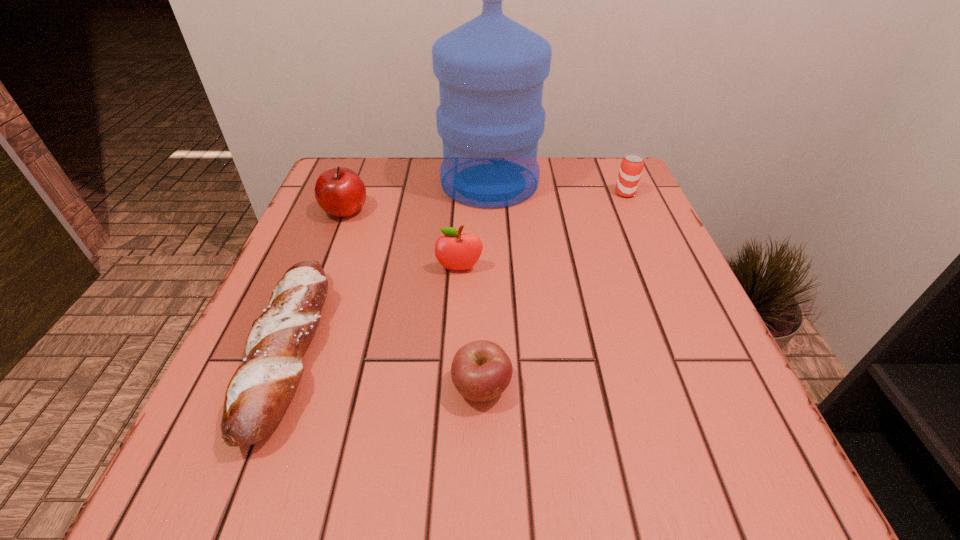
Where is `unoccupied area between the fourth farthest object and the leftmost apple`? This screenshot has width=960, height=540. unoccupied area between the fourth farthest object and the leftmost apple is located at coordinates (402, 240).

This screenshot has height=540, width=960. Find the location of `vacant space that is in between the baguet and the rightmost object`. vacant space that is in between the baguet and the rightmost object is located at coordinates (457, 272).

You are a GUI agent. You are given a task and a screenshot of the screen. Output one action in this format:
    pyautogui.click(x=<x>, y=<y>)
    Task: Click on the free space between the nearest apple and the leftmost apple
    Image resolution: width=960 pixels, height=540 pixels.
    Given the screenshot: What is the action you would take?
    pyautogui.click(x=414, y=300)

This screenshot has width=960, height=540. What are the coordinates of `free space between the fourth farthest object and the rightmost object` in the screenshot? It's located at (542, 231).

Identify the location of vacant space that is in between the fourth farthest object and the tallest object. (474, 226).

Identify the location of vacant area that lies between the leftmost apple and the fourth farthest object. (402, 240).

Locate an element on the screen. This screenshot has height=540, width=960. vacant region between the nearest apple and the baguet is located at coordinates (386, 369).

Locate which object ranks fifth in proximity to the rightmost object. Please provide its 2D coordinates. Your answer should be formatted as a tuple, i.e. [(x, y)], where the tuple contains the x and y coordinates of a point satisfying the conditions above.

[(259, 392)]

Identify which object is the second closest to the beer can. Please provide its 2D coordinates. Your answer should be formatted as a tuple, i.e. [(x, y)], where the tuple contains the x and y coordinates of a point satisfying the conditions above.

[(455, 251)]

I want to click on apple that is the closest to the tallest object, so click(340, 192).